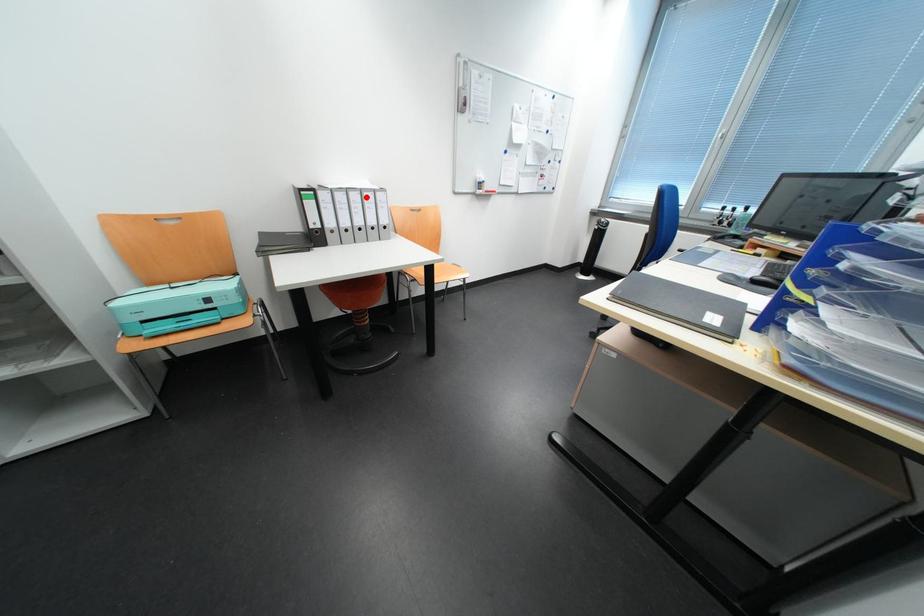
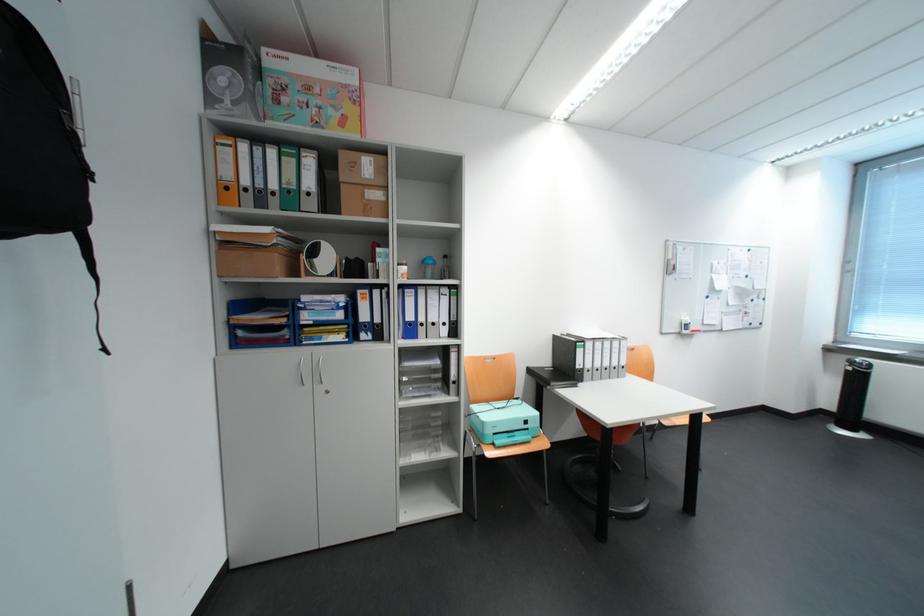
Find the pixel in the second image that matches the highlighted location in the first image.

(618, 345)